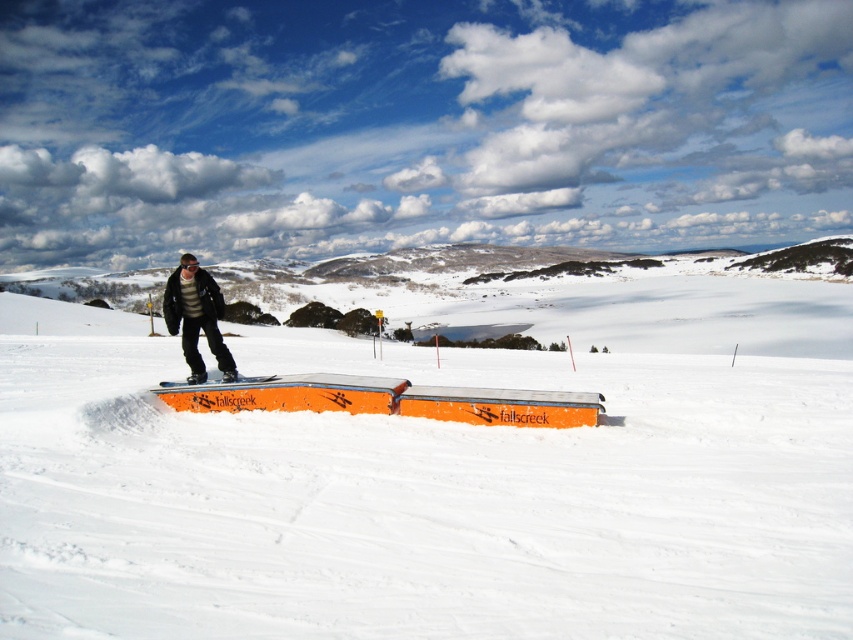
Question: Estimate the real-world distances between objects in this image. Which object is closer to the white smooth snow at center?

Choices:
 (A) orange matte snowboard at center
 (B) matte black jacket at center

Answer: (A)

Question: Is white smooth snow at center in front of matte black jacket at center?

Choices:
 (A) no
 (B) yes

Answer: (B)

Question: Can you confirm if matte black jacket at center is positioned above orange matte snowboard at center?

Choices:
 (A) yes
 (B) no

Answer: (A)

Question: Which of the following is the farthest from the observer?

Choices:
 (A) (195, 308)
 (B) (183, 387)
 (C) (817, 349)

Answer: (C)

Question: Does white smooth snow at center appear on the left side of matte black jacket at center?

Choices:
 (A) yes
 (B) no

Answer: (B)

Question: Which is nearer to the white smooth snow at center?

Choices:
 (A) orange matte snowboard at center
 (B) matte black jacket at center

Answer: (A)